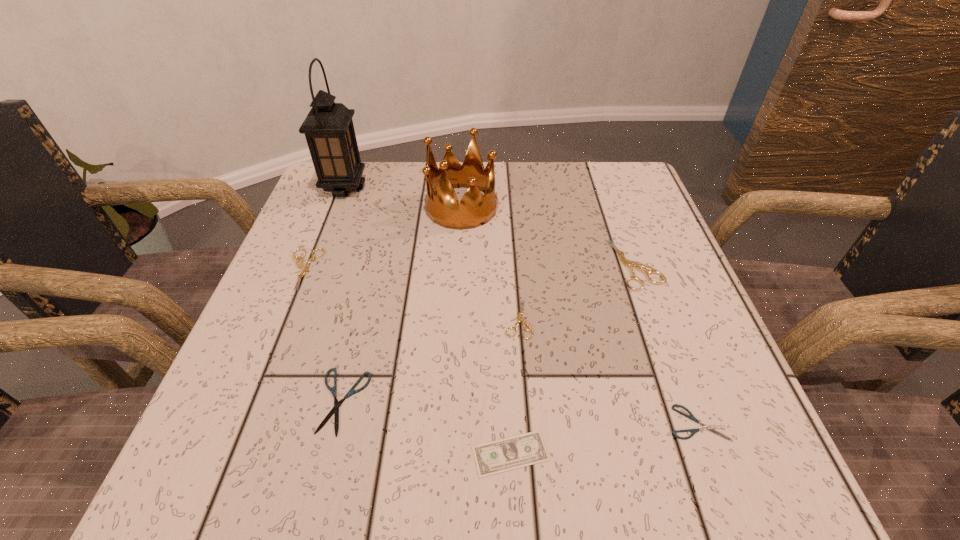
Identify the location of blank region between the sixth object from right to left and the third shears from right to left. (430, 360).

Locate an element on the screen. This screenshot has height=540, width=960. free space between the second beige shears from left to right and the lantern is located at coordinates (431, 253).

Find the location of a particular element. This screenshot has width=960, height=540. vacant area that lies between the sixth object from right to left and the shortest object is located at coordinates (426, 428).

Where is `free space between the bigger black shears and the leftmost beige shears`? free space between the bigger black shears and the leftmost beige shears is located at coordinates (323, 335).

At what (x,y) coordinates should I click in order to perform the action: click on free space that is in between the second shortest object and the third shears from left to right. Please return your answer as a coordinate pair (x, y). The image size is (960, 540). Looking at the image, I should click on point(609,371).

Identify which object is the nearest to the tallest shears. Please provide its 2D coordinates. Your answer should be formatted as a tuple, i.e. [(x, y)], where the tuple contains the x and y coordinates of a point satisfying the conditions above.

[(519, 318)]

You are a GUI agent. You are given a task and a screenshot of the screen. Output one action in this format:
    pyautogui.click(x=<x>, y=<y>)
    Task: Click on the object that is the third nearest to the tallest shears
    
    Given the screenshot: What is the action you would take?
    pyautogui.click(x=704, y=427)

Choose which shears is the fourth nearest neighbor to the biggest beige shears. Please provide its 2D coordinates. Your answer should be formatted as a tuple, i.e. [(x, y)], where the tuple contains the x and y coordinates of a point satisfying the conditions above.

[(300, 264)]

Point out which shears is positioned as the fourth nearest to the green money. Please provide its 2D coordinates. Your answer should be formatted as a tuple, i.e. [(x, y)], where the tuple contains the x and y coordinates of a point satisfying the conditions above.

[(629, 264)]

Locate which beige shears ranks third in proximity to the crown. Please provide its 2D coordinates. Your answer should be formatted as a tuple, i.e. [(x, y)], where the tuple contains the x and y coordinates of a point satisfying the conditions above.

[(629, 264)]